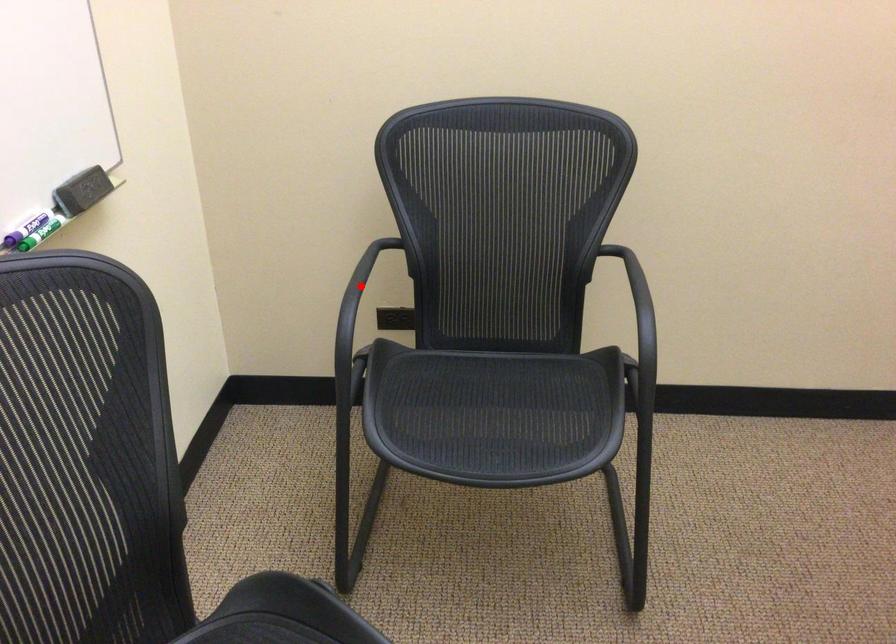
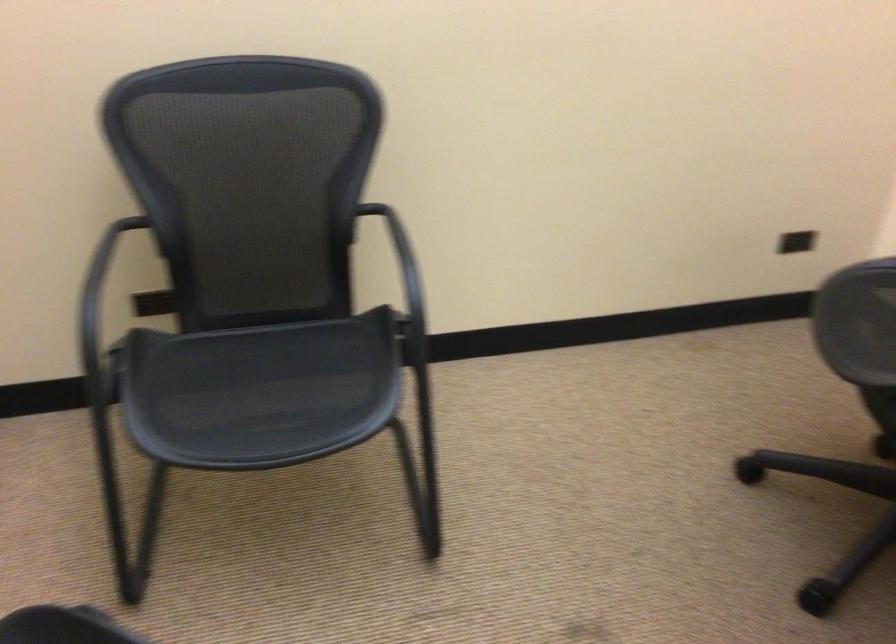
Question: I am providing you with two images of the same scene from different viewpoints. A red point is marked on the first image. Is the red point's position out of view in image 2?

Choices:
 (A) Yes
 (B) No

Answer: (A)